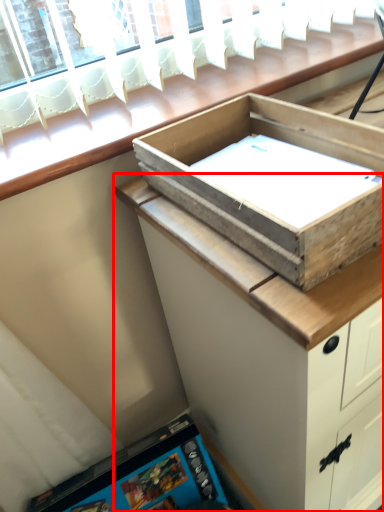
Question: Observing the image, what is the correct spatial positioning of cabinetry (annotated by the red box) in reference to box?

Choices:
 (A) left
 (B) right

Answer: (B)